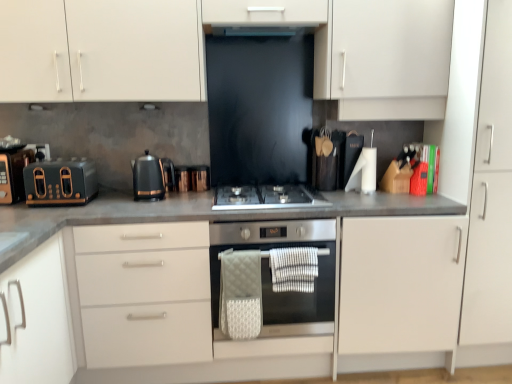
What do you see at coordinates (490, 192) in the screenshot?
I see `white matte cabinet at right` at bounding box center [490, 192].

Measure the distance between satin silver gas stove at center and camera.

A distance of 1.92 meters exists between satin silver gas stove at center and camera.

In the scene shown: Measure the distance between matte black toaster at left, the first kitchen appliance from the left, and camera.

matte black toaster at left, the first kitchen appliance from the left, is 6.58 feet from camera.

Where is `white matte cabinet at upper center, positioned as the 1th cabinetry in top-to-bottom order`? Image resolution: width=512 pixels, height=384 pixels. white matte cabinet at upper center, positioned as the 1th cabinetry in top-to-bottom order is located at coordinates (201, 47).

I want to click on stainless steel oven at center, so click(x=271, y=275).

Identify the location of white textured hand towel at center, placed as the first hand towel when sorted from right to left. The image size is (512, 384). (294, 269).

Can you confirm if white quilted hand towel at center, placed as the first hand towel when sorted from left to right, is shorter than white textured hand towel at center, which appears as the second hand towel when viewed from the left?

Incorrect, the height of white quilted hand towel at center, placed as the first hand towel when sorted from left to right, does not fall short of that of white textured hand towel at center, which appears as the second hand towel when viewed from the left.

From the image's perspective, is white quilted hand towel at center, the 2th hand towel positioned from the right, below white textured hand towel at center, placed as the first hand towel when sorted from right to left?

Indeed, from the image's perspective, white quilted hand towel at center, the 2th hand towel positioned from the right, is shown beneath white textured hand towel at center, placed as the first hand towel when sorted from right to left.

Is white quilted hand towel at center, the 2th hand towel positioned from the right, not within white textured hand towel at center, which appears as the second hand towel when viewed from the left?

Yes, white quilted hand towel at center, the 2th hand towel positioned from the right, is located beyond the bounds of white textured hand towel at center, which appears as the second hand towel when viewed from the left.

Which of these two, white quilted hand towel at center, the 2th hand towel positioned from the right, or white textured hand towel at center, placed as the first hand towel when sorted from right to left, is bigger?

Bigger between the two is white quilted hand towel at center, the 2th hand towel positioned from the right.

From the image's perspective, between gray matte countertop at center and black glass exhaust hood at upper center, which one is located above?

black glass exhaust hood at upper center.

Looking at this image, in terms of height, does gray matte countertop at center look taller or shorter compared to black glass exhaust hood at upper center?

Considering their sizes, gray matte countertop at center has more height than black glass exhaust hood at upper center.

How much distance is there between gray matte countertop at center and black glass exhaust hood at upper center?

A: They are 3.48 feet apart.

Where is `countertop in front of the black glass exhaust hood at upper center`? Image resolution: width=512 pixels, height=384 pixels. countertop in front of the black glass exhaust hood at upper center is located at coordinates click(178, 221).

Consider the image. Does white quilted hand towel at center, placed as the first hand towel when sorted from left to right, turn towards white matte cabinet at right?

No, white quilted hand towel at center, placed as the first hand towel when sorted from left to right, is not turned towards white matte cabinet at right.

Could white matte cabinet at right be considered to be inside white quilted hand towel at center, the 2th hand towel positioned from the right?

Actually, white matte cabinet at right is outside white quilted hand towel at center, the 2th hand towel positioned from the right.

Which of these two, white quilted hand towel at center, the 2th hand towel positioned from the right, or white matte cabinet at right, is bigger?

white matte cabinet at right.

Is matte black toaster at left, the 3th appliance positioned from the right, inside or outside of white quilted hand towel at center, placed as the first hand towel when sorted from left to right?

matte black toaster at left, the 3th appliance positioned from the right, is not enclosed by white quilted hand towel at center, placed as the first hand towel when sorted from left to right.

What's the angular difference between matte black toaster at left, the 3th appliance positioned from the right, and white quilted hand towel at center, placed as the first hand towel when sorted from left to right,'s facing directions?

The angular difference between matte black toaster at left, the 3th appliance positioned from the right, and white quilted hand towel at center, placed as the first hand towel when sorted from left to right, is 2.32 degrees.

Considering the relative sizes of matte black toaster at left, the 3th appliance positioned from the right, and white quilted hand towel at center, the 2th hand towel positioned from the right, in the image provided, is matte black toaster at left, the 3th appliance positioned from the right, smaller than white quilted hand towel at center, the 2th hand towel positioned from the right,?

Incorrect, matte black toaster at left, the 3th appliance positioned from the right, is not smaller in size than white quilted hand towel at center, the 2th hand towel positioned from the right.

This screenshot has width=512, height=384. Find the location of `the 3rd appliance above the white quilted hand towel at center, the 2th hand towel positioned from the right (from a real-world perspective)`. the 3rd appliance above the white quilted hand towel at center, the 2th hand towel positioned from the right (from a real-world perspective) is located at coordinates (13, 173).

Is satin silver gas stove at center facing away from white matte cabinet at right?

satin silver gas stove at center is not turned away from white matte cabinet at right.

Which point is more distant from viewer, (275, 186) or (510, 239)?

Positioned behind is point (275, 186).

From the image's perspective, relative to white matte cabinet at right, is satin silver gas stove at center above or below?

satin silver gas stove at center is below white matte cabinet at right.

Looking at this image, considering the relative sizes of satin silver gas stove at center and white matte cabinet at right in the image provided, is satin silver gas stove at center smaller than white matte cabinet at right?

Indeed, satin silver gas stove at center has a smaller size compared to white matte cabinet at right.

Can you confirm if matte black toaster at left, the 1th appliance from the left, is smaller than stainless steel oven at center?

Yes, matte black toaster at left, the 1th appliance from the left, is smaller than stainless steel oven at center.

From the image's perspective, which is below, matte black toaster at left, the 3th appliance positioned from the right, or stainless steel oven at center?

stainless steel oven at center is shown below in the image.

Is matte black toaster at left, the 1th appliance from the left, aimed at stainless steel oven at center?

No, matte black toaster at left, the 1th appliance from the left, is not turned towards stainless steel oven at center.

Does point (3, 160) come in front of point (300, 305)?

Yes, it is in front of point (300, 305).

Does white textured hand towel at center, placed as the first hand towel when sorted from right to left, turn towards white matte cabinet at right?

No, white textured hand towel at center, placed as the first hand towel when sorted from right to left, is not facing towards white matte cabinet at right.

Can you confirm if white textured hand towel at center, placed as the first hand towel when sorted from right to left, is bigger than white matte cabinet at right?

No, white textured hand towel at center, placed as the first hand towel when sorted from right to left, is not bigger than white matte cabinet at right.

The image size is (512, 384). Identify the location of the 1st hand towel to the left of the white matte cabinet at right, counting from the anchor's position. (294, 269).

Can you confirm if white textured hand towel at center, which appears as the second hand towel when viewed from the left, is taller than white matte cabinet at right?

No, white textured hand towel at center, which appears as the second hand towel when viewed from the left, is not taller than white matte cabinet at right.

There is a white quilted hand towel at center, placed as the first hand towel when sorted from left to right. Identify the location of hand towel above it (from a real-world perspective). This screenshot has width=512, height=384. (294, 269).

Locate an element on the screen. The width and height of the screenshot is (512, 384). countertop located on the left of black glass exhaust hood at upper center is located at coordinates (178, 221).

From the picture: Considering their positions, is white textured hand towel at center, placed as the first hand towel when sorted from right to left, positioned closer to gray matte countertop at center than white matte cabinet at right?

Among the two, white textured hand towel at center, placed as the first hand towel when sorted from right to left, is located nearer to gray matte countertop at center.

Which object lies nearer to the anchor point white quilted hand towel at center, the 2th hand towel positioned from the right, matte black toaster at left, the 3th appliance positioned from the right, or black metallic kettle at center, which appears as the second kitchen appliance when viewed from the left?

Among the two, black metallic kettle at center, which appears as the second kitchen appliance when viewed from the left, is located nearer to white quilted hand towel at center, the 2th hand towel positioned from the right.

Looking at the image, which one is located further to black metallic kettle at center, which appears as the second kitchen appliance when viewed from the left, matte black toaster at left, which ranks as the 2th kitchen appliance in right-to-left order, or metallic copper kettle at center, which is counted as the third appliance, starting from the left?

Based on the image, matte black toaster at left, which ranks as the 2th kitchen appliance in right-to-left order, appears to be further to black metallic kettle at center, which appears as the second kitchen appliance when viewed from the left.

Based on the photo, estimate the real-world distances between objects in this image. Which object is closer to white matte cabinet at upper center, positioned as the 1th cabinetry in top-to-bottom order, black glass exhaust hood at upper center or white quilted hand towel at center, the 2th hand towel positioned from the right?

black glass exhaust hood at upper center lies closer to white matte cabinet at upper center, positioned as the 1th cabinetry in top-to-bottom order, than the other object.

Which object lies nearer to the anchor point white textured hand towel at center, which appears as the second hand towel when viewed from the left, satin silver gas stove at center or black metallic kettle at center, positioned as the first kitchen appliance in right-to-left order?

satin silver gas stove at center is closer to white textured hand towel at center, which appears as the second hand towel when viewed from the left.

Which object lies further to the anchor point shiny copper kettle at center, the 2th appliance viewed from the left, white textured hand towel at center, placed as the first hand towel when sorted from right to left, or white matte cabinet at right?

white matte cabinet at right.

Based on their spatial positions, is satin silver gas stove at center or white matte cabinet at upper center, acting as the second cabinetry starting from the bottom, closer to shiny copper kettle at center, the 2th appliance from the right?

satin silver gas stove at center.

Estimate the real-world distances between objects in this image. Which object is further from matte black toaster at left, the 1th appliance from the left, white quilted hand towel at center, placed as the first hand towel when sorted from left to right, or shiny copper kettle at center, the 2th appliance viewed from the left?

Among the two, white quilted hand towel at center, placed as the first hand towel when sorted from left to right, is located further to matte black toaster at left, the 1th appliance from the left.

Where is `appliance located between matte black toaster at left, the 3th appliance positioned from the right, and metallic copper kettle at center, the 1th appliance from the right, in the left-right direction`? Image resolution: width=512 pixels, height=384 pixels. appliance located between matte black toaster at left, the 3th appliance positioned from the right, and metallic copper kettle at center, the 1th appliance from the right, in the left-right direction is located at coordinates (182, 178).

You are a GUI agent. You are given a task and a screenshot of the screen. Output one action in this format:
    pyautogui.click(x=<x>, y=<y>)
    Task: Click on the countertop between white matte cabinet at left, which ranks as the first cabinetry in bottom-to-top order, and white matte cabinet at right, in the horizontal direction
    This screenshot has width=512, height=384.
    Given the screenshot: What is the action you would take?
    pyautogui.click(x=178, y=221)

You are a GUI agent. You are given a task and a screenshot of the screen. Output one action in this format:
    pyautogui.click(x=<x>, y=<y>)
    Task: Click on the home appliance between black metallic kettle at center, which appears as the second kitchen appliance when viewed from the left, and white matte cabinet at right from left to right
    The width and height of the screenshot is (512, 384).
    Given the screenshot: What is the action you would take?
    pyautogui.click(x=271, y=275)

You are a GUI agent. You are given a task and a screenshot of the screen. Output one action in this format:
    pyautogui.click(x=<x>, y=<y>)
    Task: Click on the countertop between shiny copper kettle at center, the 2th appliance from the right, and white matte cabinet at right, in the horizontal direction
    Image resolution: width=512 pixels, height=384 pixels.
    Given the screenshot: What is the action you would take?
    pyautogui.click(x=178, y=221)